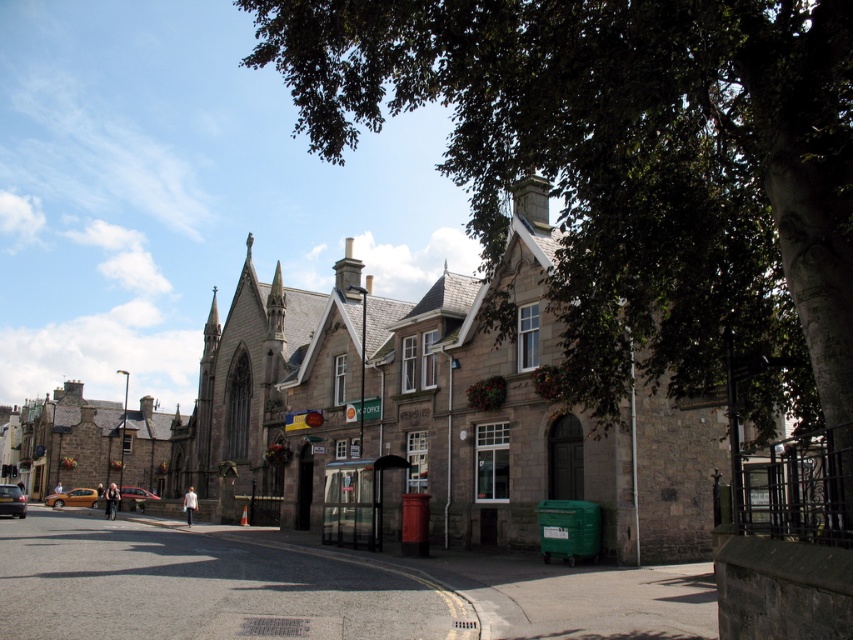
Question: Can you confirm if matte black car at lower left is positioned above metallic silver car at lower left?

Choices:
 (A) no
 (B) yes

Answer: (B)

Question: Which point is farther to the camera?

Choices:
 (A) green leafy tree at upper center
 (B) orange metallic car at lower left

Answer: (B)

Question: Among these points, which one is nearest to the camera?

Choices:
 (A) (138, 502)
 (B) (579, 268)
 (C) (90, 506)
 (D) (21, 516)

Answer: (B)

Question: Which point appears closest to the camera in this image?

Choices:
 (A) (53, 500)
 (B) (149, 497)

Answer: (B)

Question: Does matte black car at lower left appear over metallic silver car at lower left?

Choices:
 (A) yes
 (B) no

Answer: (A)

Question: Where is orange metallic car at lower left located in relation to matte black car at lower left in the image?

Choices:
 (A) left
 (B) right

Answer: (A)